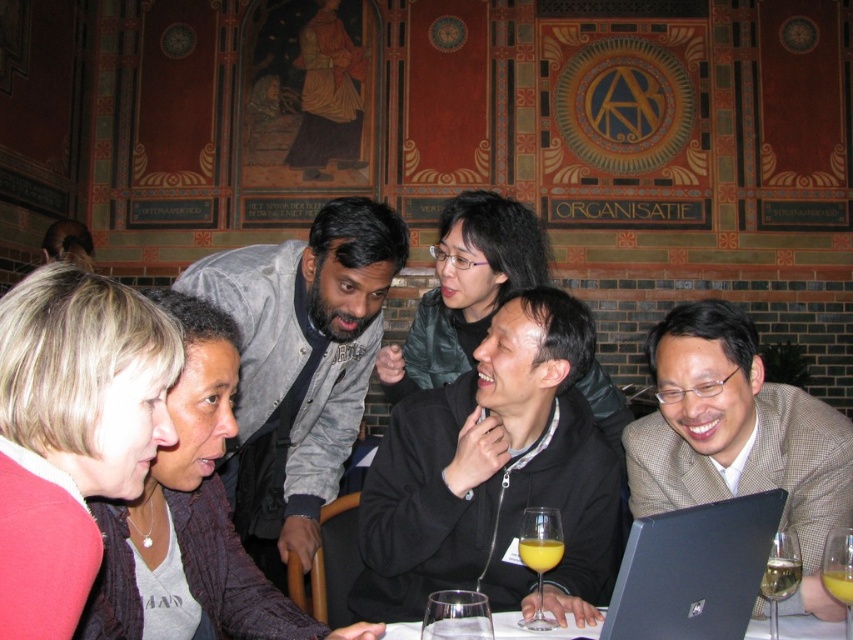
What is the 2D coordinate of the white glossy table at lower center in the image?

The white glossy table at lower center is located at the 2D coordinate point of (537, 632).

You are a photographer standing at the back of the room. You need to take a photo that includes both the black matte jacket at center and the translucent glass at table center. Given their distance apart, will they both be in frame if your camera has a 50mm lens?

The black matte jacket at center and translucent glass at table center are 16.83 feet apart. A 50mm lens has a field of view that can typically capture objects up to about 15 feet apart in the same frame at standard shooting distances. Therefore, they might not both fit in the frame with a 50mm lens.